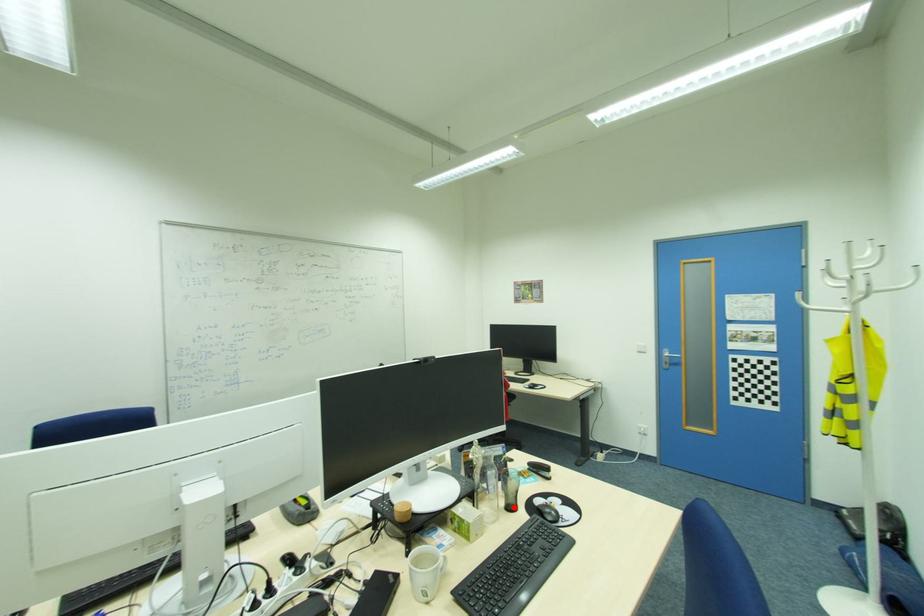
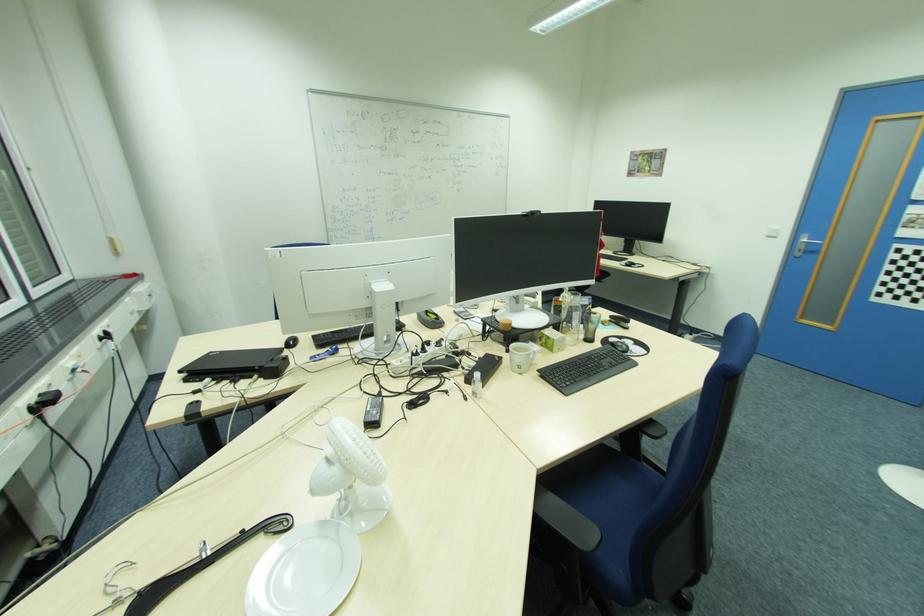
Find the pixel in the second image that matches the highlighted location in the first image.

(591, 339)